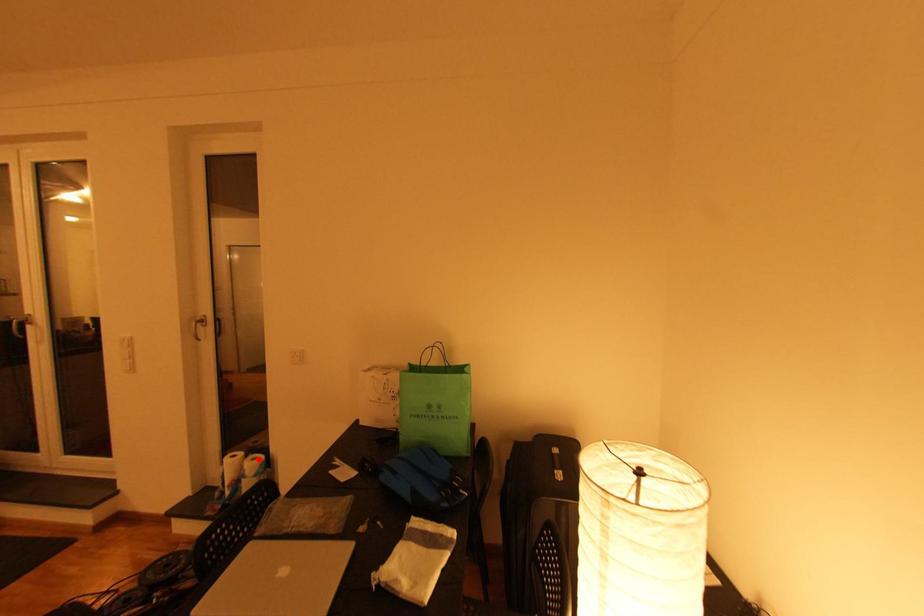
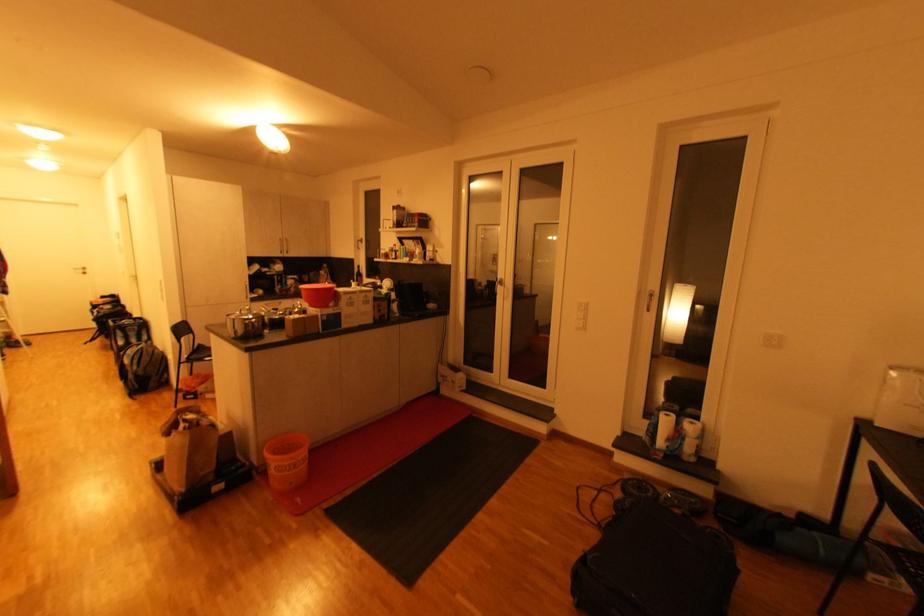
In the second image, find the point that corresponds to the highlighted location in the first image.

(698, 424)